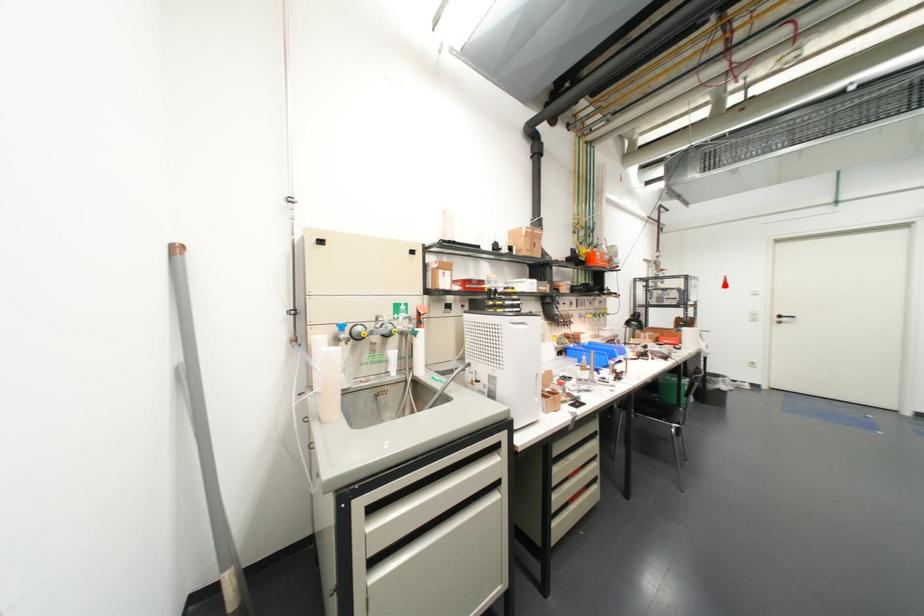
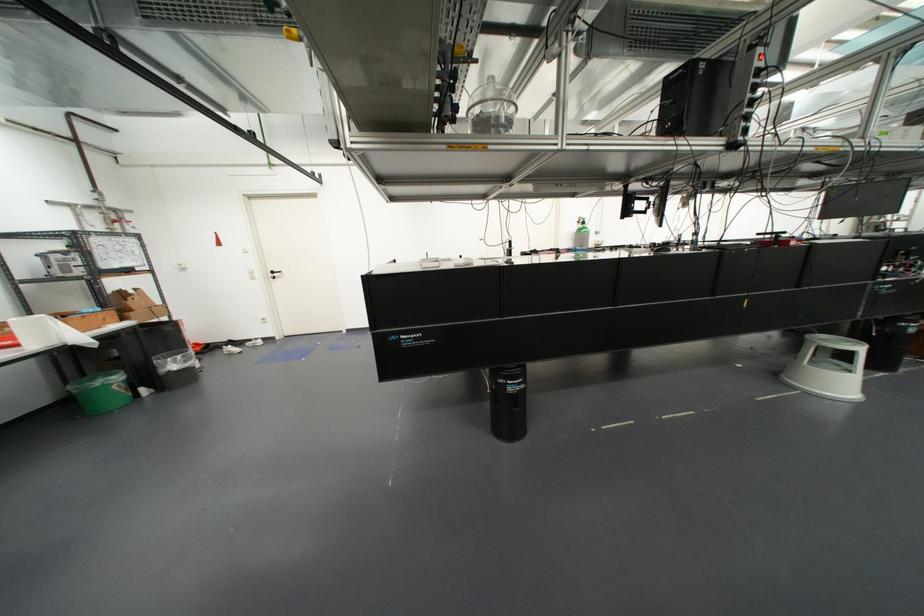
Locate, in the second image, the point that corresponds to the highlighted location in the first image.

(217, 243)